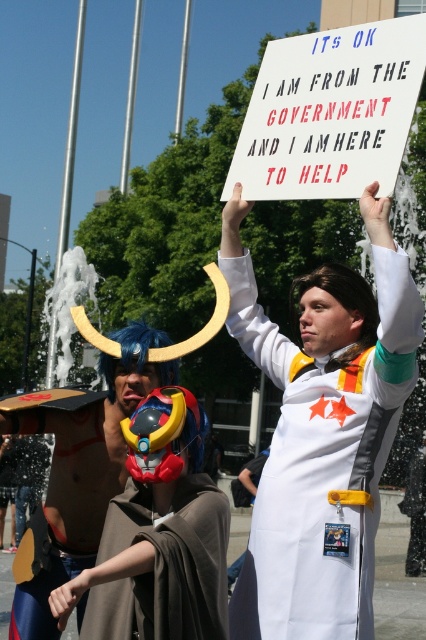
Question: Which point is farther from the camera taking this photo?

Choices:
 (A) (126, 426)
 (B) (356, 385)
 (C) (408, 113)

Answer: (B)

Question: Which of the following is the closest to the observer?

Choices:
 (A) shiny plastic mask at center
 (B) shiny blue helmet at center
 (C) white paper sign at upper center
 (D) white fabric coat at center

Answer: (A)

Question: From the image, what is the correct spatial relationship of white fabric coat at center in relation to white paper sign at upper center?

Choices:
 (A) right
 (B) left

Answer: (B)

Question: Which object is closer to the camera taking this photo?

Choices:
 (A) shiny blue helmet at center
 (B) white paper sign at upper center
 (C) shiny plastic mask at center
 (D) white fabric coat at center

Answer: (C)

Question: Is white fabric coat at center thinner than shiny plastic mask at center?

Choices:
 (A) yes
 (B) no

Answer: (B)

Question: Considering the relative positions of white paper sign at upper center and shiny plastic mask at center in the image provided, where is white paper sign at upper center located with respect to shiny plastic mask at center?

Choices:
 (A) left
 (B) right

Answer: (B)